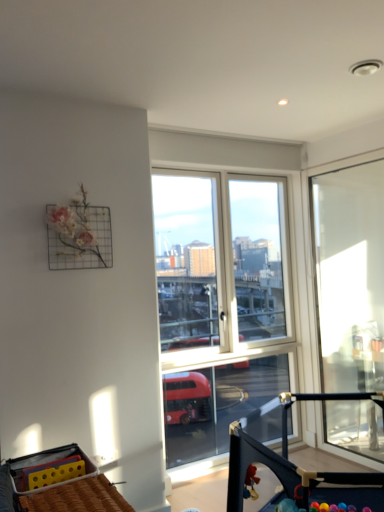
In order to face transparent glass door at right, should I rotate leftwards or rightwards?

Turn right by 19.936 degrees to look at transparent glass door at right.

Describe the element at coordinates (294, 464) in the screenshot. This screenshot has width=384, height=512. I see `black plastic baby carriage at center, the 2th baby carriage when ordered from left to right` at that location.

How much space does yellow plastic baby carriage at lower left, which is counted as the second baby carriage, starting from the right, occupy vertically?

9.75 inches.

Identify the location of transparent glass door at right. This screenshot has height=512, width=384. [350, 276].

Is yellow plastic baby carriage at lower left, arranged as the first baby carriage when viewed from the left, positioned in front of black plastic baby carriage at center, arranged as the 1th baby carriage when viewed from the right?

No, it is not.

From their relative heights in the image, would you say yellow plastic baby carriage at lower left, which is counted as the second baby carriage, starting from the right, is taller or shorter than black plastic baby carriage at center, the 2th baby carriage when ordered from left to right?

yellow plastic baby carriage at lower left, which is counted as the second baby carriage, starting from the right, is shorter than black plastic baby carriage at center, the 2th baby carriage when ordered from left to right.

Is point (50, 495) less distant than point (304, 493)?

Yes, point (50, 495) is closer to viewer.

Is yellow plastic baby carriage at lower left, arranged as the first baby carriage when viewed from the left, spatially inside black plastic baby carriage at center, arranged as the 1th baby carriage when viewed from the right, or outside of it?

yellow plastic baby carriage at lower left, arranged as the first baby carriage when viewed from the left, is spatially situated outside black plastic baby carriage at center, arranged as the 1th baby carriage when viewed from the right.

Is black plastic baby carriage at center, the 2th baby carriage when ordered from left to right, further to the viewer compared to yellow plastic baby carriage at lower left, which is counted as the second baby carriage, starting from the right?

No, black plastic baby carriage at center, the 2th baby carriage when ordered from left to right, is in front of yellow plastic baby carriage at lower left, which is counted as the second baby carriage, starting from the right.

Which is less distant, [254,446] or [20,478]?

Point [254,446] is positioned farther from the camera compared to point [20,478].

What's the angular difference between black plastic baby carriage at center, the 2th baby carriage when ordered from left to right, and yellow plastic baby carriage at lower left, arranged as the first baby carriage when viewed from the left,'s facing directions?

The angular difference between black plastic baby carriage at center, the 2th baby carriage when ordered from left to right, and yellow plastic baby carriage at lower left, arranged as the first baby carriage when viewed from the left, is 87.4 degrees.

From a real-world perspective, which object rests below the other?

black plastic baby carriage at center, arranged as the 1th baby carriage when viewed from the right.

From the image's perspective, is transparent glass door at right positioned above or below black plastic baby carriage at center, arranged as the 1th baby carriage when viewed from the right?

Based on their image positions, transparent glass door at right is located above black plastic baby carriage at center, arranged as the 1th baby carriage when viewed from the right.

Is transparent glass door at right taller than black plastic baby carriage at center, the 2th baby carriage when ordered from left to right?

Yes.

Which object is positioned more to the right, transparent glass door at right or black plastic baby carriage at center, the 2th baby carriage when ordered from left to right?

transparent glass door at right.

In the scene shown: Considering the positions of objects transparent glass door at right and yellow plastic baby carriage at lower left, arranged as the first baby carriage when viewed from the left, in the image provided, who is more to the left, transparent glass door at right or yellow plastic baby carriage at lower left, arranged as the first baby carriage when viewed from the left,?

Positioned to the left is yellow plastic baby carriage at lower left, arranged as the first baby carriage when viewed from the left.

Based on the photo, considering the relative sizes of transparent glass door at right and yellow plastic baby carriage at lower left, which is counted as the second baby carriage, starting from the right, in the image provided, is transparent glass door at right taller than yellow plastic baby carriage at lower left, which is counted as the second baby carriage, starting from the right,?

Correct, transparent glass door at right is much taller as yellow plastic baby carriage at lower left, which is counted as the second baby carriage, starting from the right.

Does transparent glass door at right touch yellow plastic baby carriage at lower left, which is counted as the second baby carriage, starting from the right?

transparent glass door at right and yellow plastic baby carriage at lower left, which is counted as the second baby carriage, starting from the right, are not in contact.

In the scene shown: Considering the relative positions of black plastic baby carriage at center, the 2th baby carriage when ordered from left to right, and transparent glass door at right in the image provided, is black plastic baby carriage at center, the 2th baby carriage when ordered from left to right, behind transparent glass door at right?

No, black plastic baby carriage at center, the 2th baby carriage when ordered from left to right, is in front of transparent glass door at right.

Considering the relative positions of black plastic baby carriage at center, the 2th baby carriage when ordered from left to right, and transparent glass door at right in the image provided, is black plastic baby carriage at center, the 2th baby carriage when ordered from left to right, to the left of transparent glass door at right from the viewer's perspective?

Yes.

From the image's perspective, between black plastic baby carriage at center, the 2th baby carriage when ordered from left to right, and transparent glass door at right, who is located below?

black plastic baby carriage at center, the 2th baby carriage when ordered from left to right, appears lower in the image.

Are black plastic baby carriage at center, the 2th baby carriage when ordered from left to right, and transparent glass door at right making contact?

black plastic baby carriage at center, the 2th baby carriage when ordered from left to right, and transparent glass door at right are not in contact.

Is yellow plastic baby carriage at lower left, arranged as the first baby carriage when viewed from the left, taller or shorter than transparent glass door at right?

In the image, yellow plastic baby carriage at lower left, arranged as the first baby carriage when viewed from the left, appears to be shorter than transparent glass door at right.

Who is bigger, yellow plastic baby carriage at lower left, arranged as the first baby carriage when viewed from the left, or transparent glass door at right?

Bigger between the two is transparent glass door at right.

Considering the sizes of yellow plastic baby carriage at lower left, arranged as the first baby carriage when viewed from the left, and transparent glass door at right in the image, is yellow plastic baby carriage at lower left, arranged as the first baby carriage when viewed from the left, wider or thinner than transparent glass door at right?

In the image, yellow plastic baby carriage at lower left, arranged as the first baby carriage when viewed from the left, appears to be wider than transparent glass door at right.

From the image's perspective, which object appears higher, yellow plastic baby carriage at lower left, which is counted as the second baby carriage, starting from the right, or transparent glass door at right?

From the image's view, transparent glass door at right is above.

Where is `baby carriage to the left of black plastic baby carriage at center, arranged as the 1th baby carriage when viewed from the right`? baby carriage to the left of black plastic baby carriage at center, arranged as the 1th baby carriage when viewed from the right is located at coordinates (59, 486).

You are a GUI agent. You are given a task and a screenshot of the screen. Output one action in this format:
    pyautogui.click(x=<x>, y=<y>)
    Task: Click on the baby carriage below the yellow plastic baby carriage at lower left, arranged as the first baby carriage when viewed from the left (from a real-world perspective)
    The height and width of the screenshot is (512, 384).
    Given the screenshot: What is the action you would take?
    pyautogui.click(x=294, y=464)

Considering their positions, is transparent glass door at right positioned further to black plastic baby carriage at center, arranged as the 1th baby carriage when viewed from the right, than yellow plastic baby carriage at lower left, arranged as the first baby carriage when viewed from the left?

transparent glass door at right is further to black plastic baby carriage at center, arranged as the 1th baby carriage when viewed from the right.

When comparing their distances from yellow plastic baby carriage at lower left, arranged as the first baby carriage when viewed from the left, does transparent glass door at right or black plastic baby carriage at center, the 2th baby carriage when ordered from left to right, seem closer?

Among the two, black plastic baby carriage at center, the 2th baby carriage when ordered from left to right, is located nearer to yellow plastic baby carriage at lower left, arranged as the first baby carriage when viewed from the left.

Based on the photo, considering their positions, is black plastic baby carriage at center, the 2th baby carriage when ordered from left to right, positioned further to transparent glass door at right than yellow plastic baby carriage at lower left, arranged as the first baby carriage when viewed from the left?

yellow plastic baby carriage at lower left, arranged as the first baby carriage when viewed from the left.

Based on their spatial positions, is yellow plastic baby carriage at lower left, which is counted as the second baby carriage, starting from the right, or transparent glass door at right closer to black plastic baby carriage at center, arranged as the 1th baby carriage when viewed from the right?

yellow plastic baby carriage at lower left, which is counted as the second baby carriage, starting from the right.

From the picture: Looking at the image, which one is located further to transparent glass door at right, yellow plastic baby carriage at lower left, arranged as the first baby carriage when viewed from the left, or black plastic baby carriage at center, the 2th baby carriage when ordered from left to right?

Based on the image, yellow plastic baby carriage at lower left, arranged as the first baby carriage when viewed from the left, appears to be further to transparent glass door at right.

Consider the image. Based on their spatial positions, is black plastic baby carriage at center, the 2th baby carriage when ordered from left to right, or transparent glass door at right closer to yellow plastic baby carriage at lower left, which is counted as the second baby carriage, starting from the right?

The object closer to yellow plastic baby carriage at lower left, which is counted as the second baby carriage, starting from the right, is black plastic baby carriage at center, the 2th baby carriage when ordered from left to right.

Locate an element on the screen. Image resolution: width=384 pixels, height=512 pixels. baby carriage situated between yellow plastic baby carriage at lower left, arranged as the first baby carriage when viewed from the left, and transparent glass door at right from left to right is located at coordinates (294, 464).